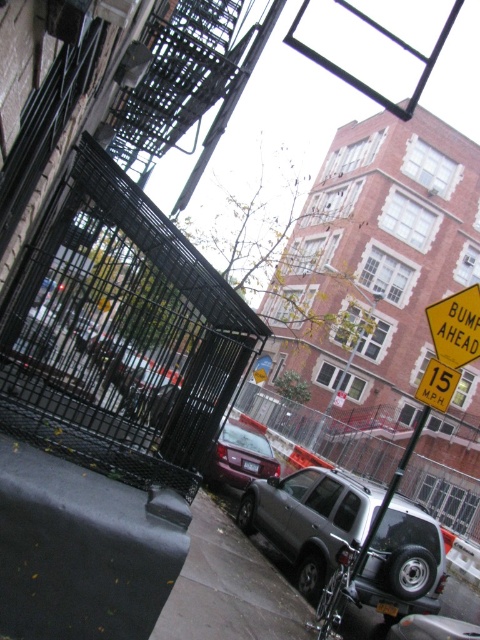
The height and width of the screenshot is (640, 480). I want to click on satin silver suv at center, so click(x=311, y=518).

What do you see at coordinates (311, 518) in the screenshot? Image resolution: width=480 pixels, height=640 pixels. I see `satin silver suv at center` at bounding box center [311, 518].

Image resolution: width=480 pixels, height=640 pixels. In order to click on satin silver suv at center in this screenshot , I will do `click(311, 518)`.

From the picture: Who is positioned more to the left, yellow/yellowish paper bumper ahead at right or yellow plastic speed limit sign at upper right?

yellow/yellowish paper bumper ahead at right is more to the left.

Is point (447, 304) closer to camera compared to point (432, 364)?

No, it is not.

Describe the element at coordinates (456, 326) in the screenshot. I see `yellow/yellowish paper bumper ahead at right` at that location.

This screenshot has width=480, height=640. I want to click on yellow/yellowish paper bumper ahead at right, so click(x=456, y=326).

Is point (260, 452) positioned after point (427, 410)?

Yes.

Can you confirm if matte purple car at center is thinner than metallic pole at center?

Indeed, matte purple car at center has a lesser width compared to metallic pole at center.

At what (x,y) coordinates should I click in order to perform the action: click on matte purple car at center. Please return your answer as a coordinate pair (x, y). This screenshot has height=640, width=480. Looking at the image, I should click on (239, 456).